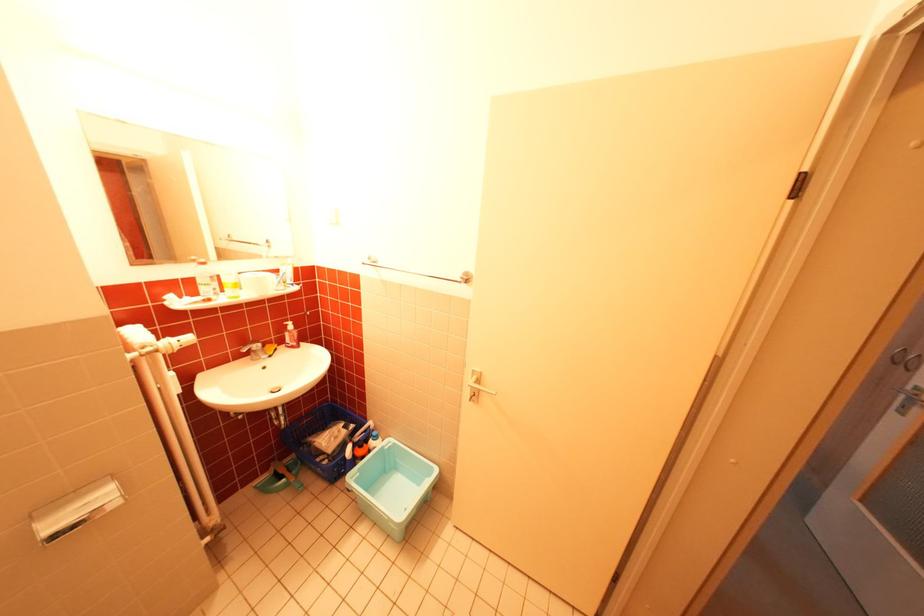
You are a GUI agent. You are given a task and a screenshot of the screen. Output one action in this format:
    pyautogui.click(x=<x>, y=<y>)
    Task: Click on the metal wall flap
    Image resolution: width=924 pixels, height=616 pixels.
    Given the screenshot: What is the action you would take?
    pyautogui.click(x=76, y=509)